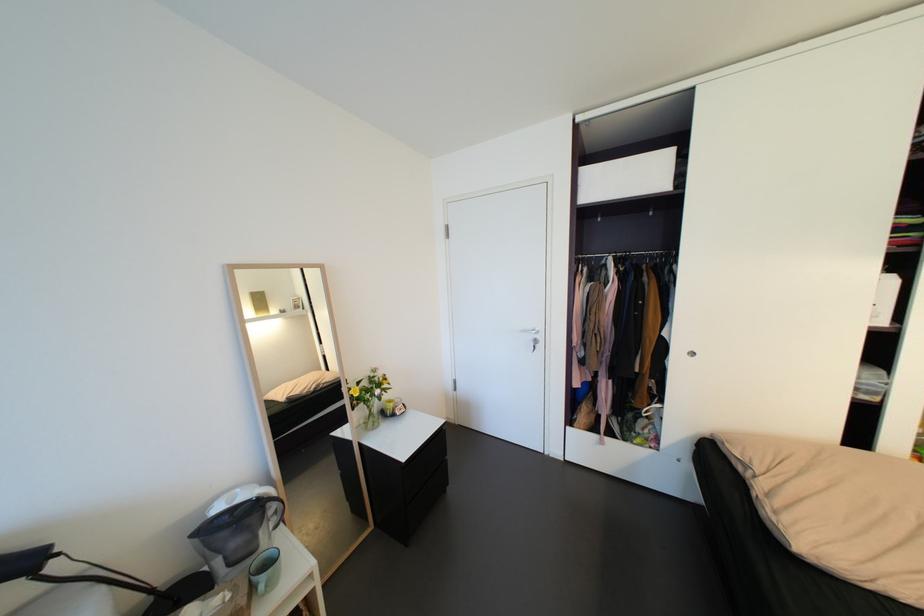
Locate an element on the screen. Image resolution: width=924 pixels, height=616 pixels. recessed door handle is located at coordinates (532, 334).